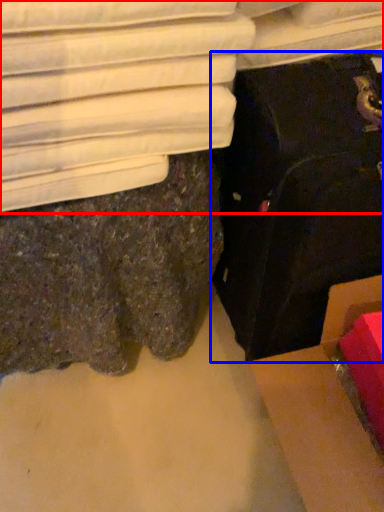
Question: Which of the following is the closest to the observer, furniture (highlighted by a red box) or suitcase (highlighted by a blue box)?

Choices:
 (A) furniture
 (B) suitcase

Answer: (B)